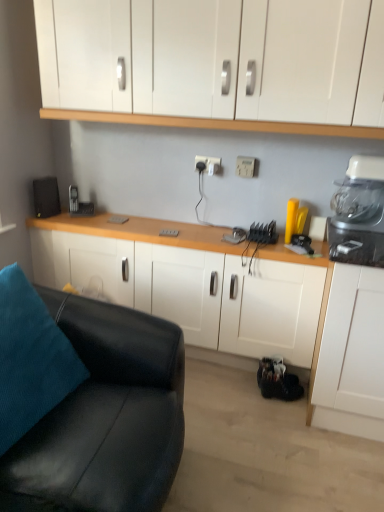
What do you see at coordinates (245, 166) in the screenshot?
I see `white plastic electric outlet at center, acting as the first electric outlet starting from the right` at bounding box center [245, 166].

This screenshot has height=512, width=384. What do you see at coordinates (294, 219) in the screenshot?
I see `yellow matte plastic container at right` at bounding box center [294, 219].

This screenshot has height=512, width=384. I want to click on black leather couch at lower left, so click(86, 402).

The image size is (384, 512). What do you see at coordinates (86, 402) in the screenshot?
I see `black leather couch at lower left` at bounding box center [86, 402].

This screenshot has height=512, width=384. What do you see at coordinates (208, 164) in the screenshot? I see `white plastic electric outlet at center, the first electric outlet when ordered from left to right` at bounding box center [208, 164].

Locate an element on the screen. This screenshot has height=512, width=384. teal fabric pillow at lower left is located at coordinates (30, 359).

From the image's perspective, is teal fabric pillow at lower left above or below white glossy cabinets at upper center, the first cabinetry when ordered from top to bottom?

Based on their image positions, teal fabric pillow at lower left is located beneath white glossy cabinets at upper center, the first cabinetry when ordered from top to bottom.

Would you say white glossy cabinets at upper center, which is counted as the second cabinetry, starting from the bottom, is part of teal fabric pillow at lower left's contents?

No, white glossy cabinets at upper center, which is counted as the second cabinetry, starting from the bottom, is located outside of teal fabric pillow at lower left.

Considering the sizes of objects teal fabric pillow at lower left and white glossy cabinets at upper center, which is counted as the second cabinetry, starting from the bottom, in the image provided, who is taller, teal fabric pillow at lower left or white glossy cabinets at upper center, which is counted as the second cabinetry, starting from the bottom,?

With more height is teal fabric pillow at lower left.

Which is behind, teal fabric pillow at lower left or white glossy cabinets at upper center, which is counted as the second cabinetry, starting from the bottom?

white glossy cabinets at upper center, which is counted as the second cabinetry, starting from the bottom, is further from the camera.

Can you confirm if white matte cabinet at center, positioned as the second cabinetry in top-to-bottom order, is shorter than black leather couch at lower left?

Yes.

From the picture: Is white matte cabinet at center, positioned as the second cabinetry in top-to-bottom order, behind black leather couch at lower left?

Yes, the depth of white matte cabinet at center, positioned as the second cabinetry in top-to-bottom order, is greater than that of black leather couch at lower left.

Looking at this image, is white matte cabinet at center, positioned as the second cabinetry in top-to-bottom order, next to black leather couch at lower left?

white matte cabinet at center, positioned as the second cabinetry in top-to-bottom order, and black leather couch at lower left are clearly separated.

Locate an element on the screen. The width and height of the screenshot is (384, 512). studio couch in front of the white matte cabinet at center, the first cabinetry ordered from the bottom is located at coordinates point(86,402).

Which object is closer to the camera, black leather couch at lower left or yellow matte plastic container at right?

black leather couch at lower left is more forward.

Consider the image. Can you tell me how much black leather couch at lower left and yellow matte plastic container at right differ in facing direction?

They differ by 90.2 degrees in their facing directions.

At what (x,y) coordinates should I click in order to perform the action: click on studio couch that appears below the yellow matte plastic container at right (from the image's perspective). Please return your answer as a coordinate pair (x, y). The height and width of the screenshot is (512, 384). Looking at the image, I should click on (86, 402).

From the image's perspective, which is below, teal fabric pillow at lower left or white plastic electric outlet at center, acting as the first electric outlet starting from the right?

teal fabric pillow at lower left is shown below in the image.

Is teal fabric pillow at lower left with white plastic electric outlet at center, which appears as the 2th electric outlet when viewed from the left?

No.

What's the angular difference between teal fabric pillow at lower left and white plastic electric outlet at center, acting as the first electric outlet starting from the right,'s facing directions?

76.8 degrees separate the facing orientations of teal fabric pillow at lower left and white plastic electric outlet at center, acting as the first electric outlet starting from the right.

Find the location of a particular element. The height and width of the screenshot is (512, 384). appliance behind the black leather couch at lower left is located at coordinates (294, 219).

In the scene shown: Who is shorter, yellow matte plastic container at right or black leather couch at lower left?

yellow matte plastic container at right.

Considering the relative positions of yellow matte plastic container at right and black leather couch at lower left in the image provided, is yellow matte plastic container at right to the left of black leather couch at lower left from the viewer's perspective?

No.

Is yellow matte plastic container at right turned away from black leather couch at lower left?

No, yellow matte plastic container at right is not facing the opposite direction of black leather couch at lower left.

Based on the photo, considering the sizes of objects white glossy cabinets at upper center, which is counted as the second cabinetry, starting from the bottom, and white plastic electric outlet at center, acting as the first electric outlet starting from the right, in the image provided, who is taller, white glossy cabinets at upper center, which is counted as the second cabinetry, starting from the bottom, or white plastic electric outlet at center, acting as the first electric outlet starting from the right,?

With more height is white glossy cabinets at upper center, which is counted as the second cabinetry, starting from the bottom.

Does point (89, 12) appear closer or farther from the camera than point (248, 163)?

Point (89, 12) is closer to the camera than point (248, 163).

In the scene shown: Looking at their sizes, would you say white glossy cabinets at upper center, the first cabinetry when ordered from top to bottom, is wider or thinner than white plastic electric outlet at center, acting as the first electric outlet starting from the right?

white glossy cabinets at upper center, the first cabinetry when ordered from top to bottom, is wider than white plastic electric outlet at center, acting as the first electric outlet starting from the right.

Between white glossy cabinets at upper center, the first cabinetry when ordered from top to bottom, and white plastic blender at upper right, which one has smaller width?

Thinner between the two is white plastic blender at upper right.

In the image, there is a white glossy cabinets at upper center, the first cabinetry when ordered from top to bottom. At what (x,y) coordinates should I click in order to perform the action: click on home appliance below it (from the image's perspective). Please return your answer as a coordinate pair (x, y). Looking at the image, I should click on (359, 214).

Considering the relative sizes of white glossy cabinets at upper center, which is counted as the second cabinetry, starting from the bottom, and white plastic blender at upper right in the image provided, is white glossy cabinets at upper center, which is counted as the second cabinetry, starting from the bottom, taller than white plastic blender at upper right?

Yes.

Considering the sizes of white glossy cabinets at upper center, which is counted as the second cabinetry, starting from the bottom, and white plastic blender at upper right in the image, is white glossy cabinets at upper center, which is counted as the second cabinetry, starting from the bottom, bigger or smaller than white plastic blender at upper right?

white glossy cabinets at upper center, which is counted as the second cabinetry, starting from the bottom, is bigger than white plastic blender at upper right.

Locate an element on the screen. This screenshot has height=512, width=384. the 1st cabinetry behind the teal fabric pillow at lower left, counting from the anchor's position is located at coordinates (213, 64).

This screenshot has width=384, height=512. I want to click on studio couch below the white matte cabinet at center, the first cabinetry ordered from the bottom (from the image's perspective), so click(86, 402).

Based on their spatial positions, is black leather couch at lower left or white plastic electric outlet at center, which appears as the 2th electric outlet when viewed from the left, closer to white plastic blender at upper right?

white plastic electric outlet at center, which appears as the 2th electric outlet when viewed from the left.

From the image, which object appears to be nearer to yellow matte plastic container at right, white plastic blender at upper right or black leather couch at lower left?

white plastic blender at upper right.

Based on their spatial positions, is white plastic electric outlet at center, acting as the first electric outlet starting from the right, or yellow matte plastic container at right further from white plastic blender at upper right?

white plastic electric outlet at center, acting as the first electric outlet starting from the right.

Consider the image. When comparing their distances from white plastic electric outlet at center, the first electric outlet when ordered from left to right, does white glossy cabinets at upper center, the first cabinetry when ordered from top to bottom, or teal fabric pillow at lower left seem further?

teal fabric pillow at lower left.

Based on their spatial positions, is black leather couch at lower left or white plastic electric outlet at center, which appears as the 2th electric outlet when viewed from the left, closer to white glossy cabinets at upper center, which is counted as the second cabinetry, starting from the bottom?

Among the two, white plastic electric outlet at center, which appears as the 2th electric outlet when viewed from the left, is located nearer to white glossy cabinets at upper center, which is counted as the second cabinetry, starting from the bottom.

Estimate the real-world distances between objects in this image. Which object is closer to white glossy cabinets at upper center, which is counted as the second cabinetry, starting from the bottom, white plastic blender at upper right or white matte cabinet at center, the first cabinetry ordered from the bottom?

white plastic blender at upper right.

Considering their positions, is black leather couch at lower left positioned closer to white glossy cabinets at upper center, which is counted as the second cabinetry, starting from the bottom, than teal fabric pillow at lower left?

The object closer to white glossy cabinets at upper center, which is counted as the second cabinetry, starting from the bottom, is black leather couch at lower left.

Which object lies nearer to the anchor point white plastic blender at upper right, yellow matte plastic container at right or white matte cabinet at center, positioned as the second cabinetry in top-to-bottom order?

Among the two, yellow matte plastic container at right is located nearer to white plastic blender at upper right.

Identify the location of pillow located between black leather couch at lower left and white plastic electric outlet at center, which appears as the 2th electric outlet when viewed from the left, in the depth direction. (30, 359).

Image resolution: width=384 pixels, height=512 pixels. Identify the location of home appliance between black leather couch at lower left and yellow matte plastic container at right from front to back. (359, 214).

Where is `cabinetry between white glossy cabinets at upper center, which is counted as the second cabinetry, starting from the bottom, and black leather couch at lower left in the up-down direction`? cabinetry between white glossy cabinets at upper center, which is counted as the second cabinetry, starting from the bottom, and black leather couch at lower left in the up-down direction is located at coordinates [195, 291].

Identify the location of pillow between black leather couch at lower left and yellow matte plastic container at right in the front-back direction. (30, 359).